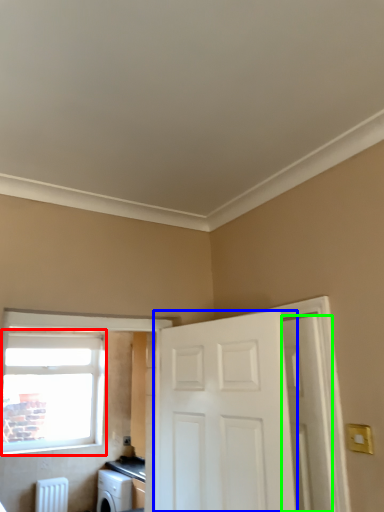
Question: Considering the real-world distances, which object is closest to window (highlighted by a red box)? door (highlighted by a blue box) or door (highlighted by a green box).

Choices:
 (A) door
 (B) door

Answer: (A)